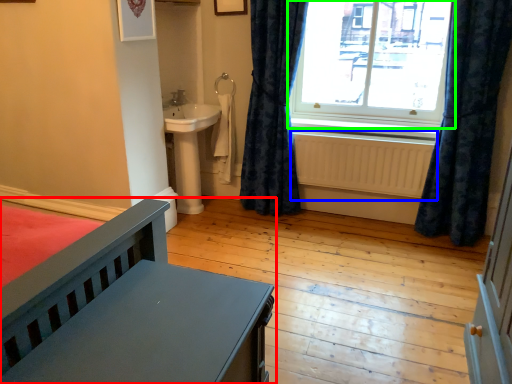
Question: Which is farther away from furniture (highlighted by a red box)? radiator (highlighted by a blue box) or window (highlighted by a green box)?

Choices:
 (A) radiator
 (B) window

Answer: (B)